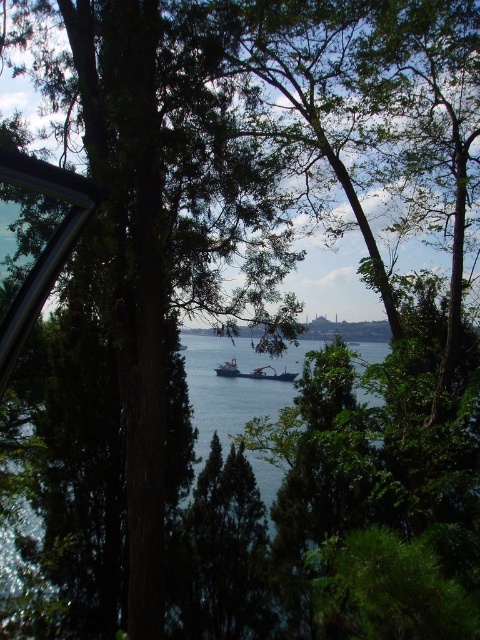
Is point (274, 369) less distant than point (227, 371)?

Yes, point (274, 369) is closer to viewer.

Between point (217, 371) and point (225, 364), which one is positioned in front?

Point (225, 364) is more forward.

Who is more forward, (x=244, y=374) or (x=219, y=372)?

Positioned in front is point (x=244, y=374).

This screenshot has width=480, height=640. I want to click on metallic blue ship at center, so click(252, 372).